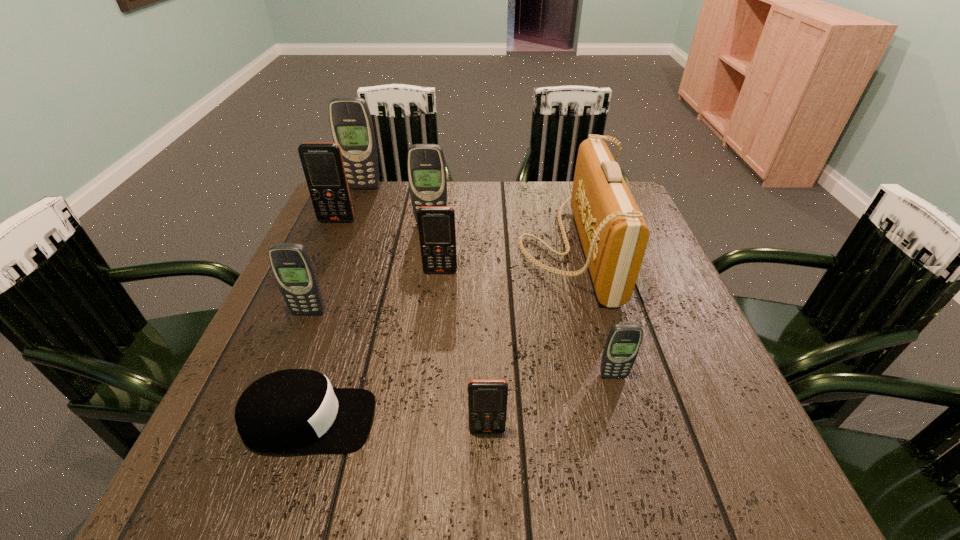
Find the location of a particular element. cap that is at the left edge is located at coordinates (289, 411).

Locate an element on the screen. This screenshot has width=960, height=540. object present at the right edge is located at coordinates (614, 235).

You are a GUI agent. You are given a task and a screenshot of the screen. Output one action in this format:
    pyautogui.click(x=<x>, y=<y>)
    Task: Click on the object at the near left corner
    The width and height of the screenshot is (960, 540).
    Given the screenshot: What is the action you would take?
    pyautogui.click(x=289, y=411)

The height and width of the screenshot is (540, 960). Find the location of `object situated at the far right corner`. object situated at the far right corner is located at coordinates (614, 235).

This screenshot has height=540, width=960. In order to click on vacant space at the far edge in this screenshot , I will do `click(510, 185)`.

Identify the location of vacant area at the near edge of the desktop. This screenshot has height=540, width=960. (375, 485).

Find the location of `free location at the left edge`. free location at the left edge is located at coordinates (362, 231).

You are a GUI agent. You are given a task and a screenshot of the screen. Output one action in this format:
    pyautogui.click(x=<x>, y=<y>)
    Task: Click on the vacant position at the right edge of the desktop
    This screenshot has height=540, width=960.
    Given the screenshot: What is the action you would take?
    pyautogui.click(x=672, y=310)

The width and height of the screenshot is (960, 540). In the image, there is a desktop. Identify the location of vacant area at the far left corner. (371, 225).

You are a GUI agent. You are given a task and a screenshot of the screen. Output one action in this format:
    pyautogui.click(x=<x>, y=<y>)
    Task: Click on the vacant space at the near left corner of the desktop
    The width and height of the screenshot is (960, 540).
    Given the screenshot: What is the action you would take?
    pyautogui.click(x=188, y=488)